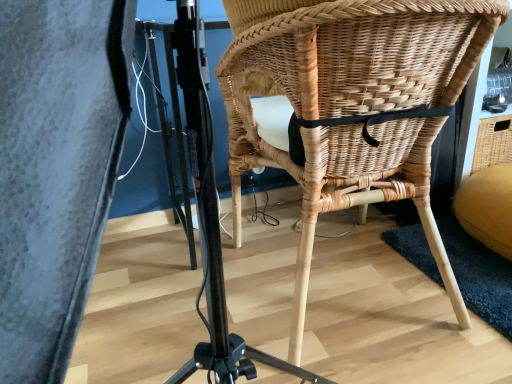
Identify the location of vacant space positioned to the left of natural wicker chair at center. The height and width of the screenshot is (384, 512). (153, 292).